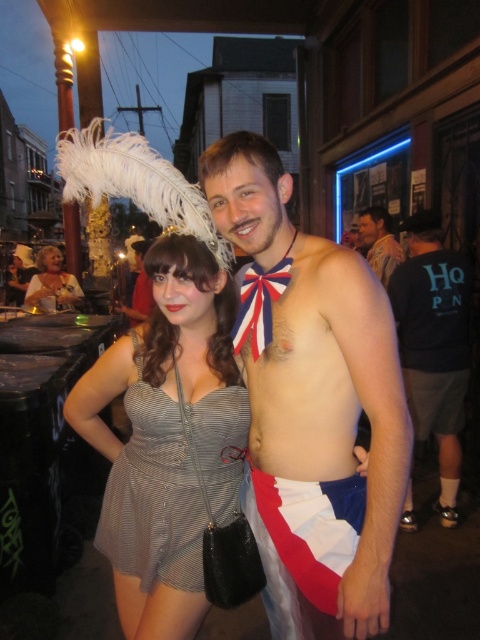
Is shiny fabric bow tie at center below dark blue t-shirt at center?

Yes, shiny fabric bow tie at center is below dark blue t-shirt at center.

What do you see at coordinates (312, 404) in the screenshot? The height and width of the screenshot is (640, 480). I see `shiny fabric bow tie at center` at bounding box center [312, 404].

At what (x,y) coordinates should I click in order to perform the action: click on shiny fabric bow tie at center. Please return your answer as a coordinate pair (x, y). Looking at the image, I should click on (312, 404).

Can you confirm if shiny fabric bow tie at center is bigger than silver metallic dress at center?

Yes, shiny fabric bow tie at center is bigger than silver metallic dress at center.

Is point (310, 269) less distant than point (199, 556)?

Yes, point (310, 269) is closer to viewer.

What are the coordinates of `shiny fabric bow tie at center` in the screenshot? It's located at (312, 404).

Find the location of a particular element. This screenshot has width=480, height=640. shiny fabric bow tie at center is located at coordinates (312, 404).

Is shiny fabric bow tie at center below matte silver dress at center?

Yes, shiny fabric bow tie at center is below matte silver dress at center.

Is point (260, 355) positioned in front of point (36, 291)?

Yes, point (260, 355) is in front of point (36, 291).

Locate an element on the screen. The width and height of the screenshot is (480, 640). shiny fabric bow tie at center is located at coordinates (312, 404).